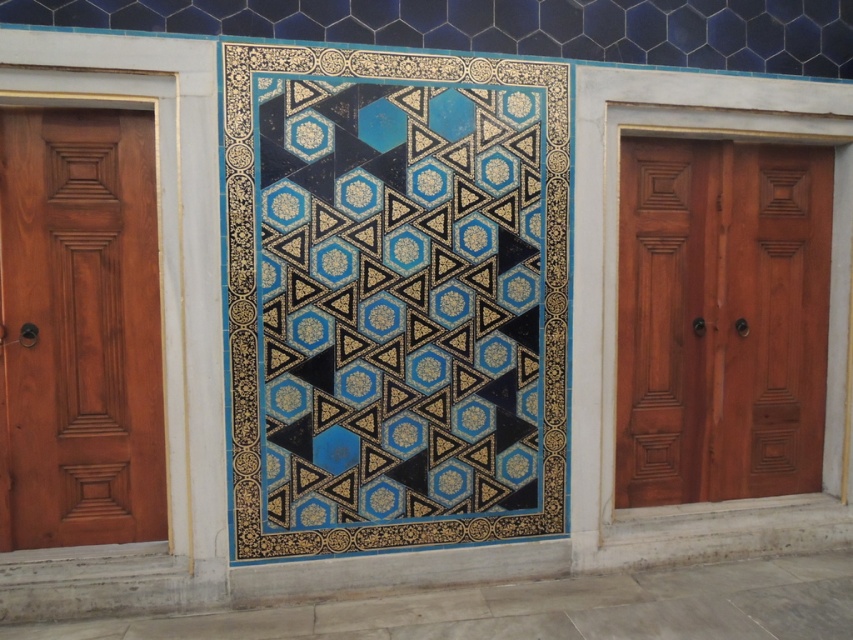
Is mahogany wood door at right in front of mahogany wood door at left?

No, it is not.

This screenshot has width=853, height=640. Identify the location of mahogany wood door at right. (721, 320).

The height and width of the screenshot is (640, 853). I want to click on mahogany wood door at right, so click(721, 320).

Can you confirm if blue glossy tile at center is taller than mahogany wood door at left?

Yes.

Is blue glossy tile at center positioned at the back of mahogany wood door at left?

No, it is not.

This screenshot has width=853, height=640. In order to click on blue glossy tile at center in this screenshot , I will do `click(395, 298)`.

Where is `blue glossy tile at center`? blue glossy tile at center is located at coordinates (395, 298).

What do you see at coordinates (395, 298) in the screenshot? I see `blue glossy tile at center` at bounding box center [395, 298].

Between blue glossy tile at center and mahogany wood door at right, which one appears on the right side from the viewer's perspective?

mahogany wood door at right

Measure the distance between blue glossy tile at center and camera.

15.40 feet

I want to click on blue glossy tile at center, so click(395, 298).